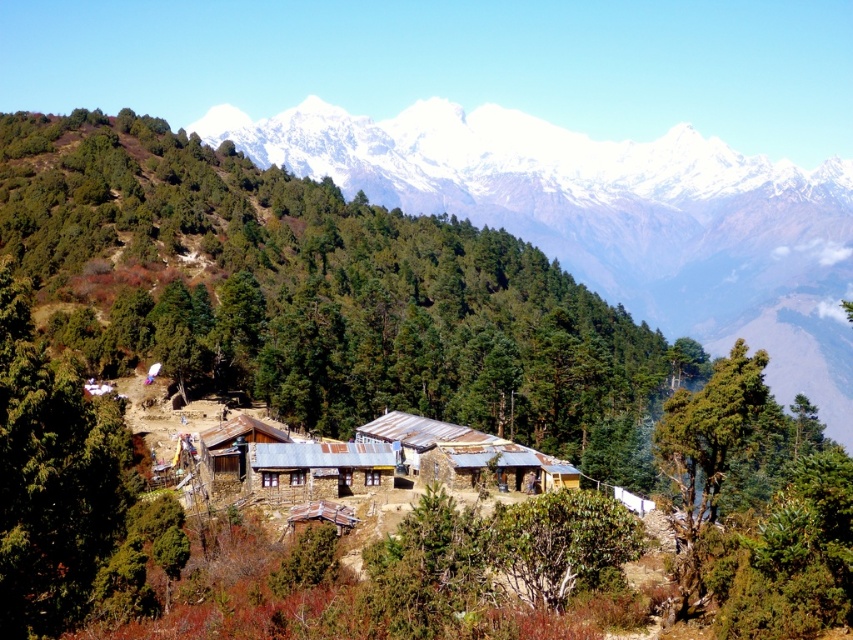
You are a hiker who wants to take a photo of both the brown stone hut at center and the brown wooden hut at center. Since you want them both in the frame, which one should you stand closer to?

You should stand closer to the brown wooden hut at center because it is shorter than the brown stone hut at center, allowing both to fit within the camera frame more easily.